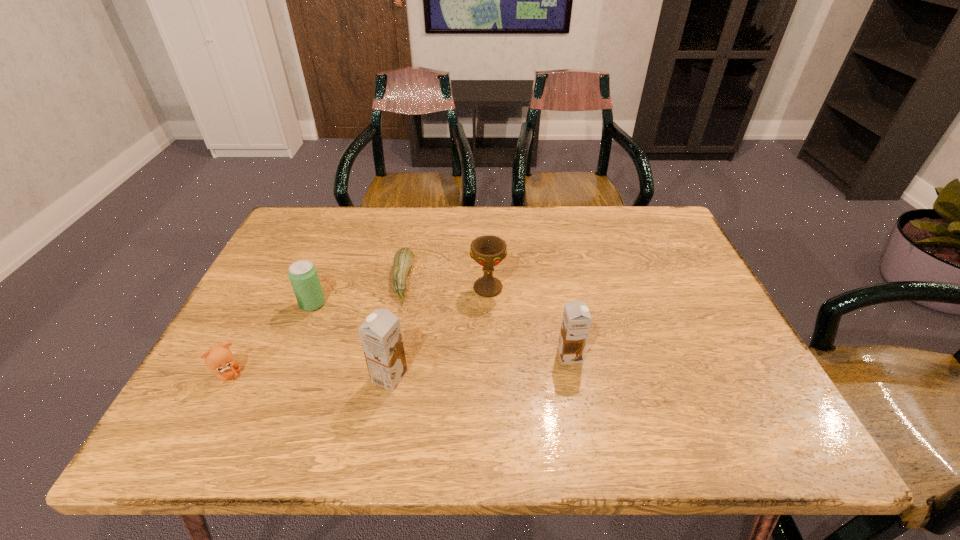
You are a GUI agent. You are given a task and a screenshot of the screen. Output one action in this format:
    pyautogui.click(x=<x>, y=<y>)
    Task: Click on the vacant area situated on the left of the left chocolate milk
    Image resolution: width=960 pixels, height=540 pixels.
    Given the screenshot: What is the action you would take?
    pyautogui.click(x=267, y=377)

At what (x,y) coordinates should I click in order to perform the action: click on blank space located 0.140m on the right of the shorter chocolate milk. Please return your answer as a coordinate pair (x, y). Image resolution: width=960 pixels, height=540 pixels. Looking at the image, I should click on (645, 355).

Locate an element on the screen. blank area located 0.320m on the right of the fourth tallest object is located at coordinates (455, 304).

Image resolution: width=960 pixels, height=540 pixels. I want to click on vacant space located on the left of the chalice, so click(439, 288).

What are the coordinates of `vacant region located on the face of the leftmost object` in the screenshot? It's located at (389, 375).

Identify the location of blank space located 0.070m at the stem end of the zucchini. This screenshot has height=540, width=960. (x=439, y=280).

Locate an element on the screen. The image size is (960, 540). chocolate milk located in the near edge section of the desktop is located at coordinates (380, 334).

What are the coordinates of `teddy bear that is positioned at the near edge` in the screenshot? It's located at (219, 359).

Locate an element on the screen. This screenshot has width=960, height=540. soda that is positioned at the left edge is located at coordinates (303, 275).

Identify the location of teddy bear situated at the left edge. The height and width of the screenshot is (540, 960). (219, 359).